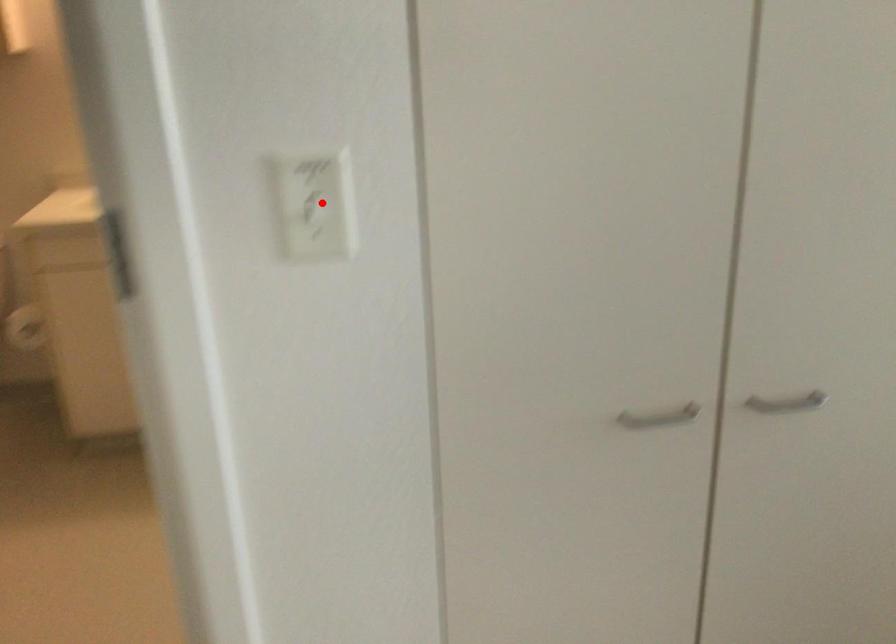
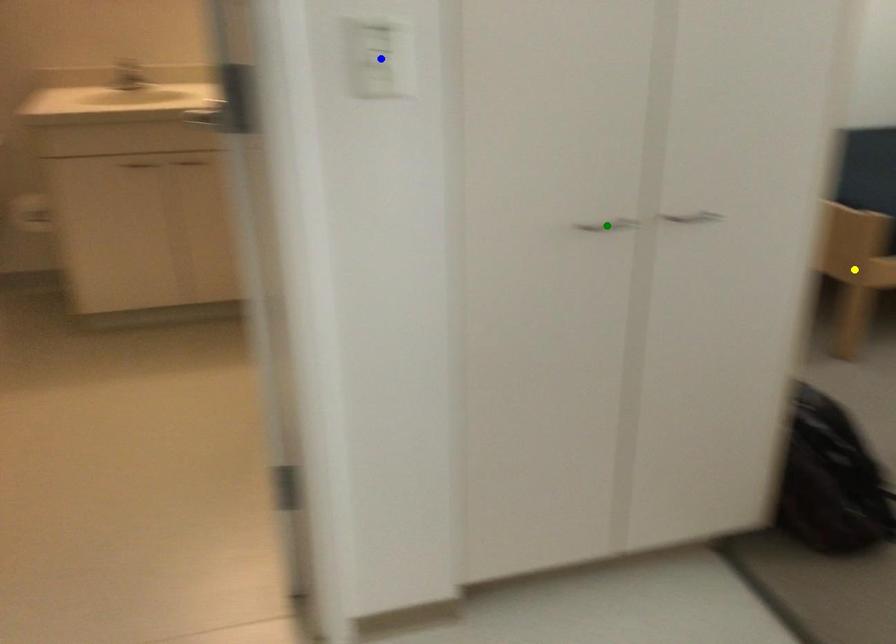
Question: I am providing you with two images of the same scene from different viewpoints. A red point is marked on the first image. You are given multiple points on the second image. Which mark in image 2 goes with the point in image 1?

Choices:
 (A) blue point
 (B) yellow point
 (C) green point

Answer: (A)